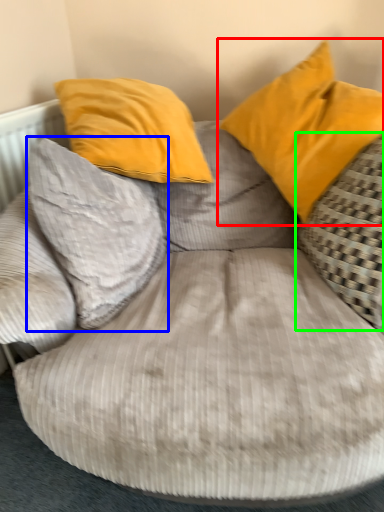
Question: Considering the real-world distances, which object is farthest from pillow (highlighted by a red box)? pillow (highlighted by a blue box) or pillow (highlighted by a green box)?

Choices:
 (A) pillow
 (B) pillow

Answer: (A)